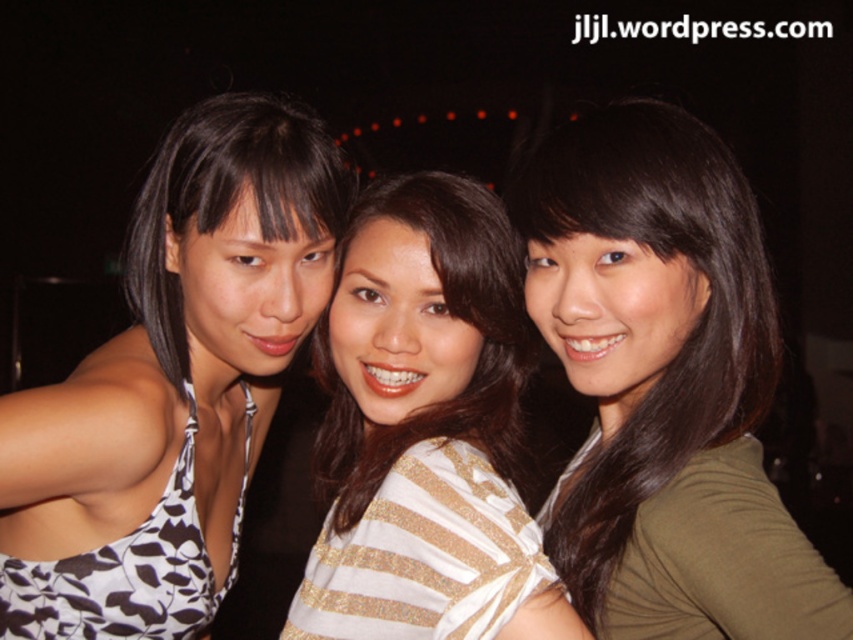
Between point (850, 612) and point (370, 336), which one is positioned in front?

Positioned in front is point (850, 612).

Does matte olive green shirt at center come in front of striped fabric shirt at center?

Yes, matte olive green shirt at center is closer to the viewer.

The width and height of the screenshot is (853, 640). I want to click on matte olive green shirt at center, so click(x=664, y=385).

Where is `matte olive green shirt at center`? Image resolution: width=853 pixels, height=640 pixels. matte olive green shirt at center is located at coordinates 664,385.

Identify the location of white printed dress at left. (175, 365).

Based on the photo, is white printed dress at left shorter than striped fabric shirt at center?

No, white printed dress at left is not shorter than striped fabric shirt at center.

Does point (225, 241) come behind point (480, 616)?

Yes, it is behind point (480, 616).

Where is `white printed dress at left`? The image size is (853, 640). white printed dress at left is located at coordinates (175, 365).

Which of these two, matte olive green shirt at center or white printed dress at left, stands taller?

Standing taller between the two is white printed dress at left.

Is matte olive green shirt at center positioned in front of white printed dress at left?

Yes, it is.

Is point (602, 618) positioned in front of point (80, 509)?

Yes, point (602, 618) is in front of point (80, 509).

Image resolution: width=853 pixels, height=640 pixels. In order to click on matte olive green shirt at center in this screenshot , I will do `click(664, 385)`.